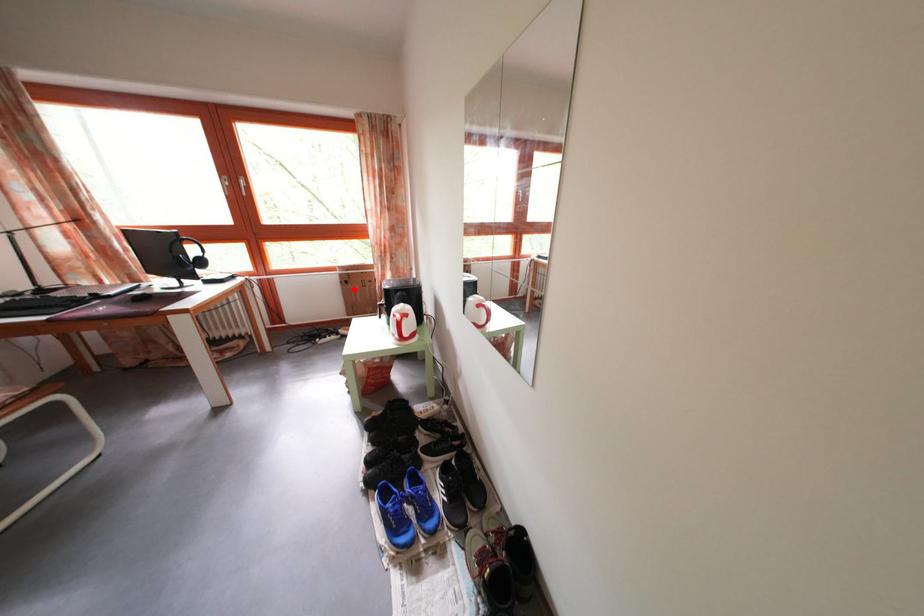
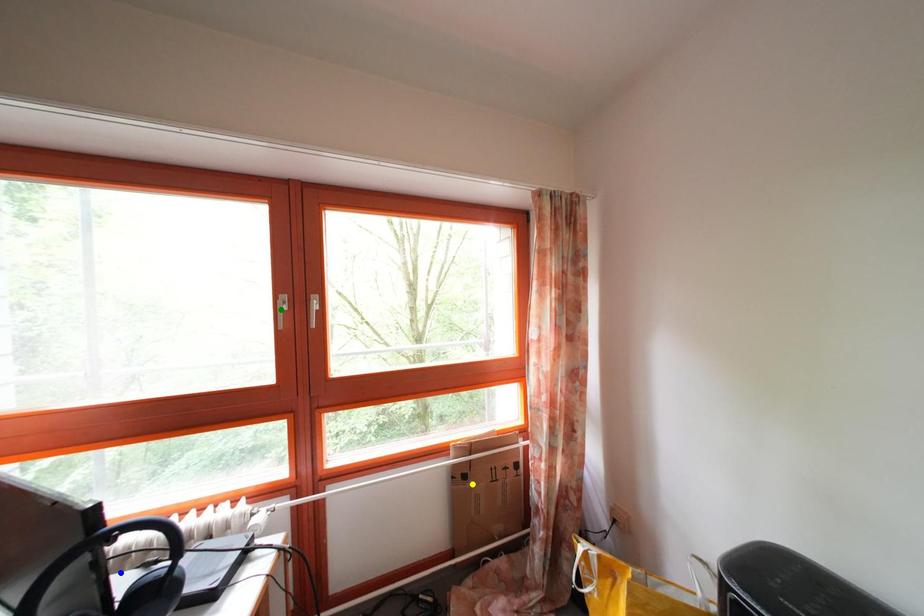
Question: I am providing you with two images of the same scene from different viewpoints. A red point is marked on the first image. You are given multiple points on the second image. In image 2, which mark is for the same physical point as the one in image 1?

Choices:
 (A) green point
 (B) yellow point
 (C) blue point

Answer: (B)